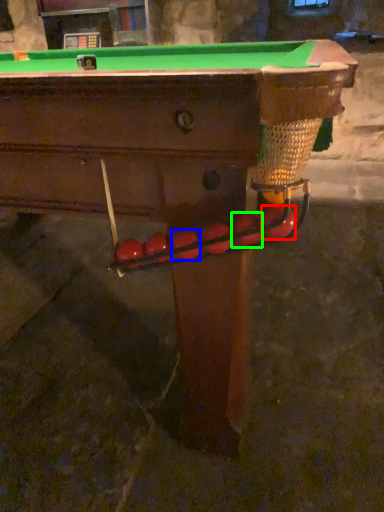
Question: Based on their relative distances, which object is nearer to fruit (highlighted by a red box)? Choose from fruit (highlighted by a blue box) and fruit (highlighted by a green box).

Choices:
 (A) fruit
 (B) fruit

Answer: (B)